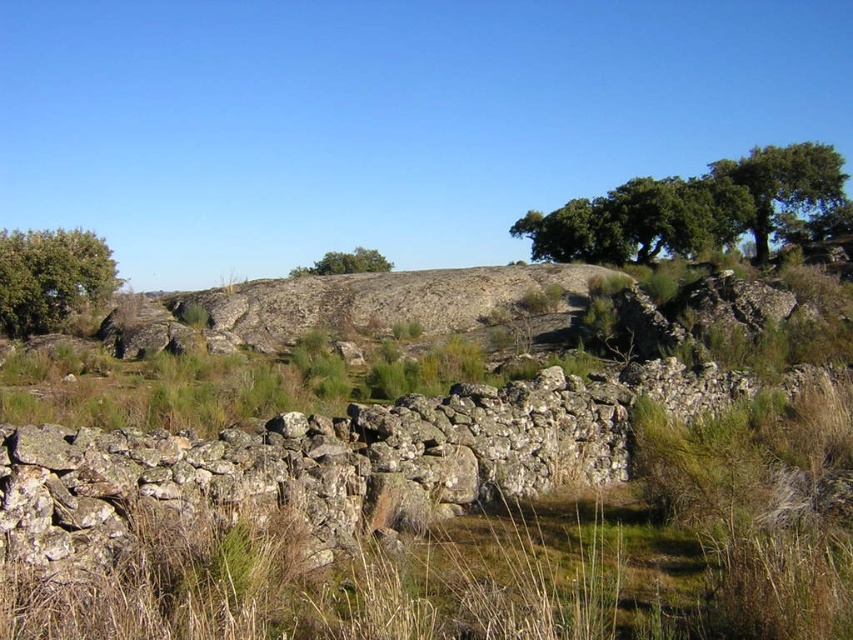
Between weathered stone wall at center and green leafy tree at left, which one has less height?

weathered stone wall at center

Is weathered stone wall at center thinner than green leafy tree at left?

Yes, weathered stone wall at center is thinner than green leafy tree at left.

Describe the element at coordinates (312, 465) in the screenshot. I see `weathered stone wall at center` at that location.

This screenshot has height=640, width=853. Find the location of `weathered stone wall at center`. weathered stone wall at center is located at coordinates (312, 465).

Which is in front, point (630, 253) or point (321, 266)?

Point (630, 253) is in front.

Is green leafy tree at upper right taller than green leafy tree at center?

Correct, green leafy tree at upper right is much taller as green leafy tree at center.

Identify the location of green leafy tree at upper right. (689, 209).

Does green leafy tree at left come behind green leafy tree at center?

No, it is not.

Is point (62, 241) more distant than point (347, 266)?

No, (62, 241) is closer to viewer.

I want to click on green leafy tree at left, so click(x=51, y=278).